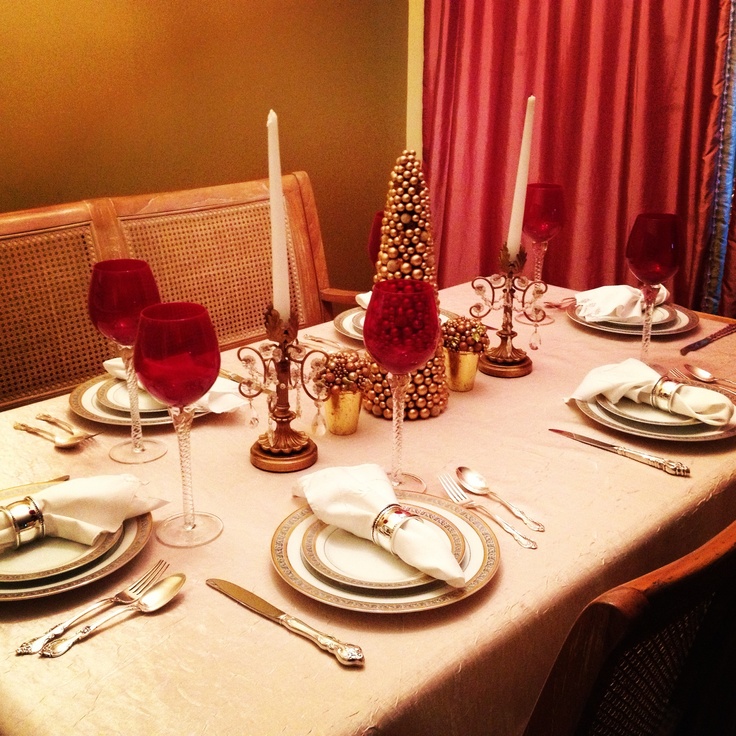
I want to click on dinner plates, so click(408, 609), click(696, 435), click(686, 319), click(343, 330), click(88, 411), click(91, 576).